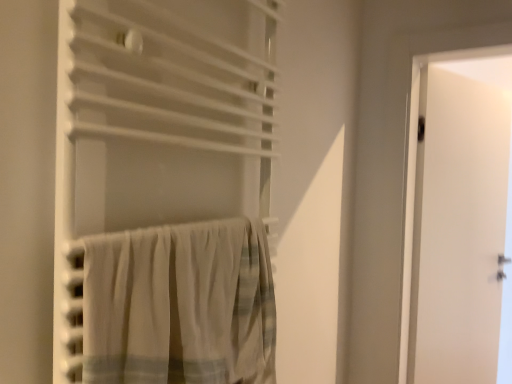
Question: Considering their positions, is white cotton curtain at lower left, arranged as the 1th curtain when ordered from the bottom, located in front of or behind white fabric curtain at center, the 2th curtain positioned from the bottom?

Choices:
 (A) front
 (B) behind

Answer: (B)

Question: From a real-world perspective, is white cotton curtain at lower left, arranged as the 1th curtain when ordered from the bottom, positioned above or below white fabric curtain at center, the 2th curtain positioned from the bottom?

Choices:
 (A) above
 (B) below

Answer: (B)

Question: Which is nearer to the white matte door at right?

Choices:
 (A) white cotton curtain at lower left, arranged as the 1th curtain when ordered from the bottom
 (B) white fabric curtain at center, which is counted as the 1th curtain, starting from the top

Answer: (B)

Question: Estimate the real-world distances between objects in this image. Which object is closer to the white cotton curtain at lower left, arranged as the 1th curtain when ordered from the bottom?

Choices:
 (A) white fabric curtain at center, the 2th curtain positioned from the bottom
 (B) white matte door at right

Answer: (A)